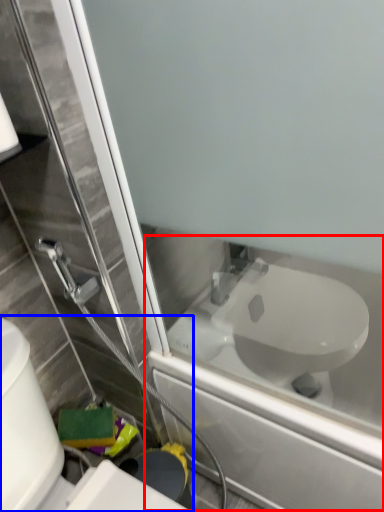
Question: Which object is further to the camera taking this photo, bath (highlighted by a red box) or toilet (highlighted by a blue box)?

Choices:
 (A) bath
 (B) toilet

Answer: (A)